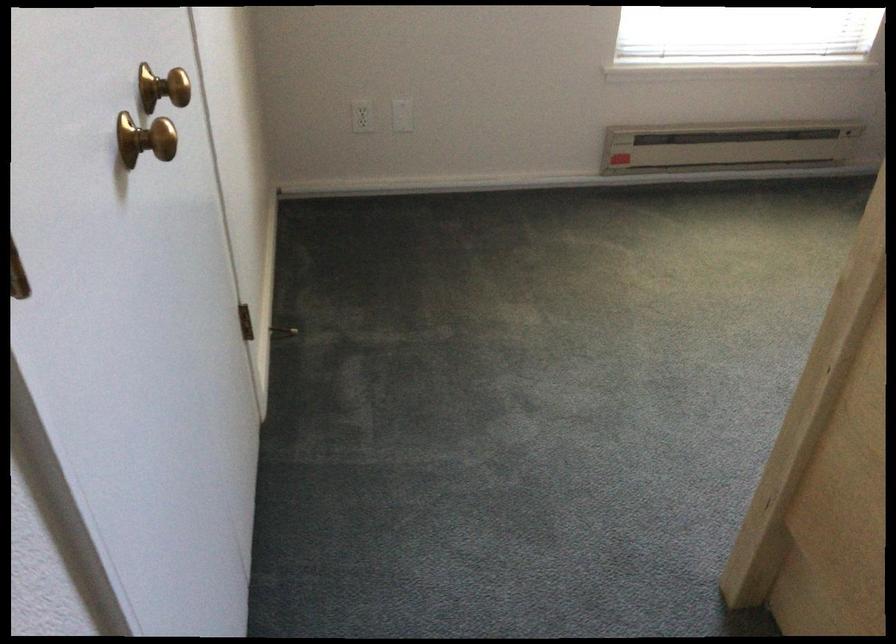
The height and width of the screenshot is (644, 896). In order to click on electrical outlet in this screenshot , I will do `click(362, 116)`.